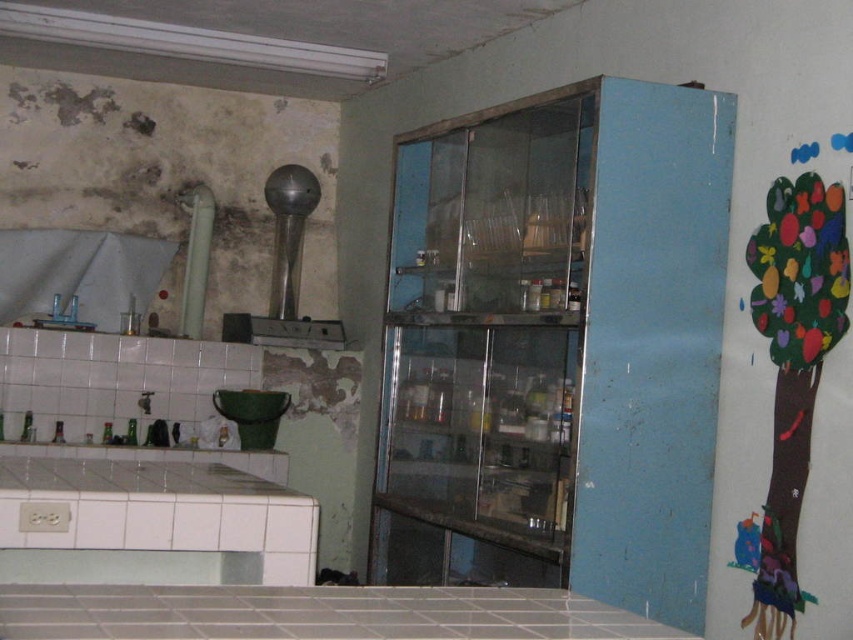
Question: Among these objects, which one is farthest from the camera?

Choices:
 (A) white tile counter at lower center
 (B) white tile counter at lower left

Answer: (B)

Question: Is white tile counter at lower left bigger than white tile counter at lower center?

Choices:
 (A) no
 (B) yes

Answer: (B)

Question: Is white tile counter at lower left positioned in front of white tile counter at lower center?

Choices:
 (A) no
 (B) yes

Answer: (A)

Question: From the image, what is the correct spatial relationship of white tile counter at lower left in relation to white tile counter at lower center?

Choices:
 (A) left
 (B) right

Answer: (A)